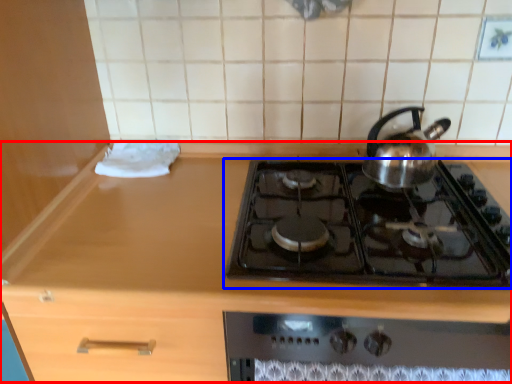
Question: Which object is closer to the camera taking this photo, counter (highlighted by a red box) or gas stove (highlighted by a blue box)?

Choices:
 (A) counter
 (B) gas stove

Answer: (A)